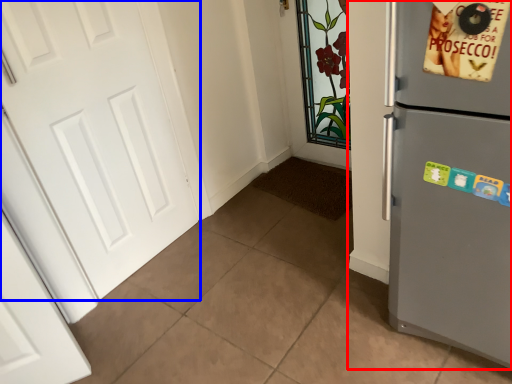
Question: Which point is further to the camera, refrigerator (highlighted by a red box) or door (highlighted by a blue box)?

Choices:
 (A) refrigerator
 (B) door

Answer: (B)